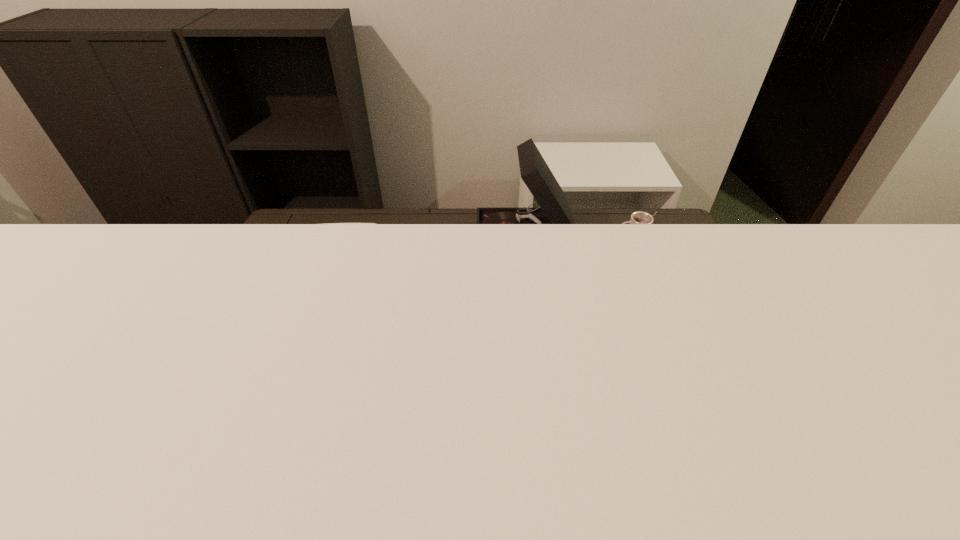
You are a GUI agent. You are given a task and a screenshot of the screen. Output one action in this format:
    pyautogui.click(x=<x>, y=<y>)
    Task: Click on the vacant space at the far edge of the desktop
    Image resolution: width=960 pixels, height=540 pixels.
    Given the screenshot: What is the action you would take?
    pyautogui.click(x=344, y=220)

Where is `vacant area at the near edge`? vacant area at the near edge is located at coordinates (332, 475).

Identify the location of vacant space at the left edge. Image resolution: width=960 pixels, height=540 pixels. (206, 406).

In the image, there is a desktop. Find the location of `vacant space at the right edge`. vacant space at the right edge is located at coordinates pos(672,300).

The width and height of the screenshot is (960, 540). I want to click on vacant space at the far left corner of the desktop, so click(x=321, y=225).

Identify the location of vacant region at the near left corner of the desktop. (186, 444).

In the image, there is a desktop. In order to click on free region at the far right corner in this screenshot , I will do `click(642, 232)`.

At what (x,y) coordinates should I click in order to perform the action: click on vacant space in between the shortest object and the phonograph_record. Please return your answer as a coordinate pair (x, y). The height and width of the screenshot is (540, 960). Looking at the image, I should click on (578, 241).

The width and height of the screenshot is (960, 540). In order to click on free area in between the second object from right to left and the shortest object in this screenshot , I will do `click(578, 241)`.

At what (x,y) coordinates should I click in order to perform the action: click on free point between the shortest object and the second object from right to left. Please return your answer as a coordinate pair (x, y). Looking at the image, I should click on (578, 241).